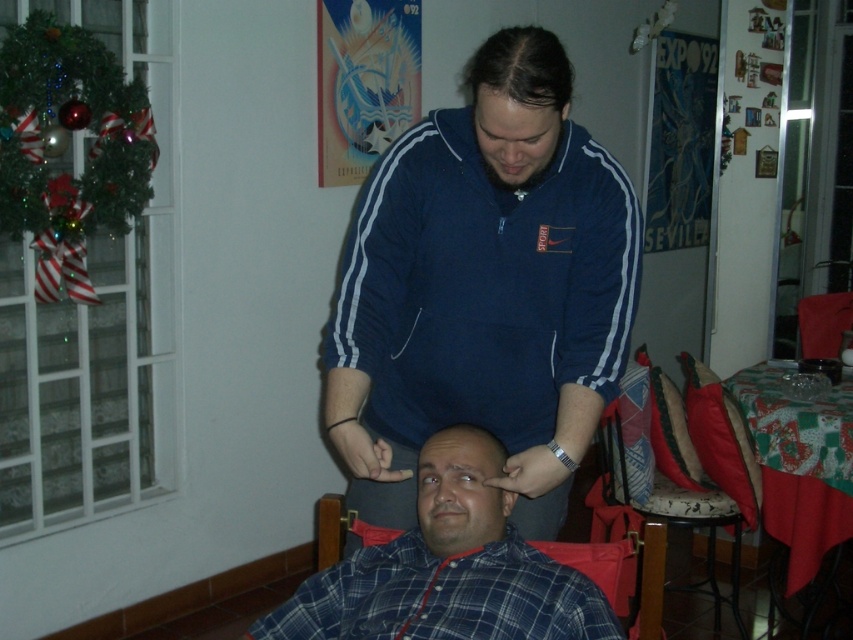
Is blue fleece jacket at upper center above dark brown hair at center?

Incorrect, blue fleece jacket at upper center is not positioned above dark brown hair at center.

Is point (515, 449) positioned after point (480, 72)?

Yes, point (515, 449) is farther from viewer.

At what (x,y) coordinates should I click in order to perform the action: click on blue fleece jacket at upper center. Please return your answer as a coordinate pair (x, y). Looking at the image, I should click on (485, 289).

In the scene shown: Can you confirm if blue fleece jacket at upper center is positioned below velvet cushioned chair at right?

No, blue fleece jacket at upper center is not below velvet cushioned chair at right.

Does blue fleece jacket at upper center have a larger size compared to velvet cushioned chair at right?

Actually, blue fleece jacket at upper center might be smaller than velvet cushioned chair at right.

Is point (410, 445) positioned before point (705, 500)?

Yes, it is in front of point (705, 500).

What are the coordinates of `blue fleece jacket at upper center` in the screenshot? It's located at (485, 289).

Locate an element on the screen. The image size is (853, 640). blue fleece jacket at upper center is located at coordinates (485, 289).

How far apart are blue fleece jacket at upper center and blue plaid shirt at center?

The distance of blue fleece jacket at upper center from blue plaid shirt at center is 9.01 inches.

I want to click on blue fleece jacket at upper center, so click(x=485, y=289).